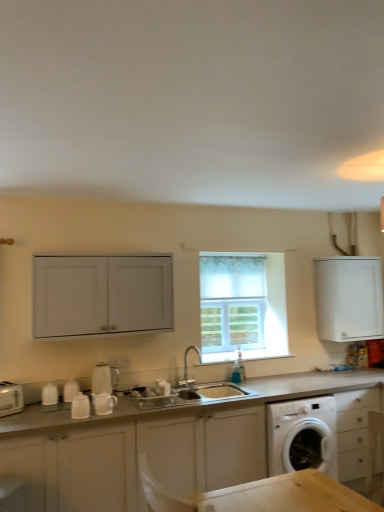
Question: From a real-world perspective, is satin silver sink at center over white matte cabinet at upper left, the 3th cabinetry from the bottom?

Choices:
 (A) no
 (B) yes

Answer: (A)

Question: Can you confirm if satin silver sink at center is positioned to the right of white matte cabinet at upper left, the first cabinetry from the left?

Choices:
 (A) yes
 (B) no

Answer: (A)

Question: From a real-world perspective, is satin silver sink at center below white matte cabinet at upper left, the 1th cabinetry positioned from the top?

Choices:
 (A) yes
 (B) no

Answer: (A)

Question: Does satin silver sink at center have a lesser height compared to white matte cabinet at upper left, the 1th cabinetry positioned from the top?

Choices:
 (A) no
 (B) yes

Answer: (B)

Question: Is satin silver sink at center located outside white matte cabinet at upper left, the first cabinetry from the left?

Choices:
 (A) yes
 (B) no

Answer: (A)

Question: Can you confirm if satin silver sink at center is taller than white matte cabinet at upper left, the 1th cabinetry positioned from the top?

Choices:
 (A) yes
 (B) no

Answer: (B)

Question: Is white matte cabinet at upper right, which is counted as the 2th cabinetry, starting from the bottom, to the left of white ceramic mug at lower left, arranged as the 4th appliance when viewed from the left, from the viewer's perspective?

Choices:
 (A) no
 (B) yes

Answer: (A)

Question: Can you see white matte cabinet at upper right, which is counted as the 2th cabinetry, starting from the bottom, touching white ceramic mug at lower left, arranged as the 4th appliance when viewed from the left?

Choices:
 (A) yes
 (B) no

Answer: (B)

Question: Is white matte cabinet at upper right, placed as the first cabinetry when sorted from right to left, positioned before white ceramic mug at lower left, arranged as the 4th appliance when viewed from the left?

Choices:
 (A) no
 (B) yes

Answer: (A)

Question: Would you say white matte cabinet at upper right, placed as the first cabinetry when sorted from right to left, is outside white ceramic mug at lower left, which is counted as the 1th appliance, starting from the right?

Choices:
 (A) yes
 (B) no

Answer: (A)

Question: Considering the relative sizes of white matte cabinet at upper right, the third cabinetry when ordered from left to right, and white ceramic mug at lower left, arranged as the 4th appliance when viewed from the left, in the image provided, is white matte cabinet at upper right, the third cabinetry when ordered from left to right, wider than white ceramic mug at lower left, arranged as the 4th appliance when viewed from the left,?

Choices:
 (A) yes
 (B) no

Answer: (A)

Question: From the image's perspective, is white matte cabinet at upper right, placed as the first cabinetry when sorted from right to left, beneath white ceramic mug at lower left, which is counted as the 1th appliance, starting from the right?

Choices:
 (A) no
 (B) yes

Answer: (A)

Question: Is white glossy kettle at center, acting as the third appliance starting from the left, bigger than white ceramic mug at lower left, arranged as the 4th appliance when viewed from the left?

Choices:
 (A) no
 (B) yes

Answer: (B)